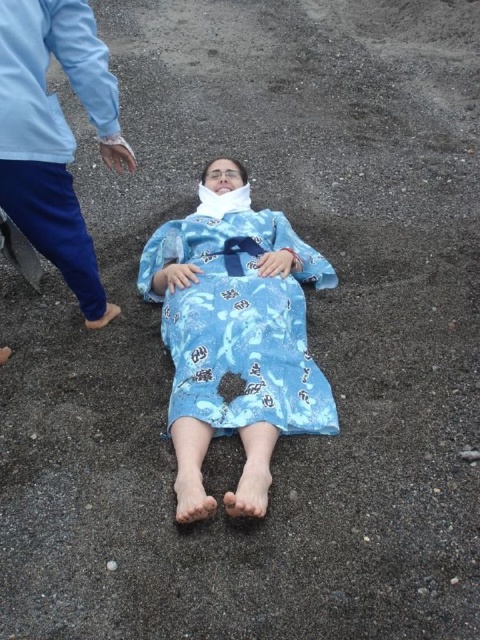
Question: Which point is farther to the camera?

Choices:
 (A) (203, 237)
 (B) (52, 150)

Answer: (A)

Question: Does blue printed fabric at center have a lesser width compared to blue printed robe at upper left?

Choices:
 (A) no
 (B) yes

Answer: (A)

Question: Does blue printed fabric at center appear on the right side of blue printed robe at upper left?

Choices:
 (A) no
 (B) yes

Answer: (B)

Question: Can you confirm if blue printed fabric at center is wider than blue printed robe at upper left?

Choices:
 (A) yes
 (B) no

Answer: (A)